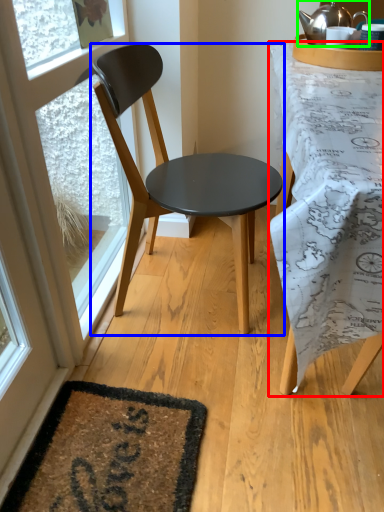
Question: Estimate the real-world distances between objects in this image. Which object is closer to desk (highlighted by a red box), chair (highlighted by a blue box) or kettle (highlighted by a green box)?

Choices:
 (A) chair
 (B) kettle

Answer: (A)